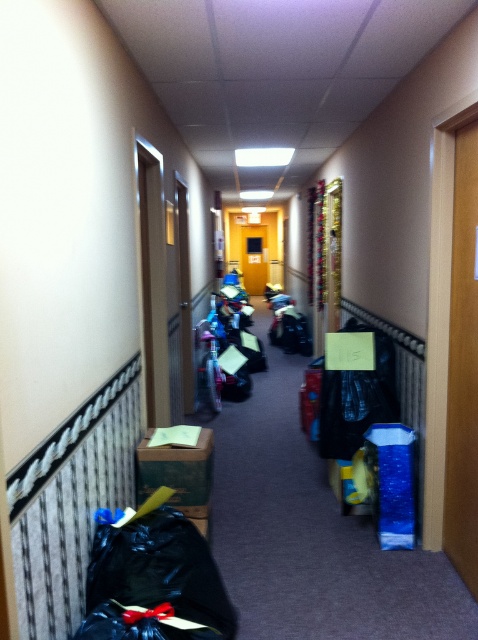
Is black plastic bag at lower left below green cardboard box at lower center?

Yes.

Is point (161, 586) positioned after point (141, 468)?

No, (161, 586) is closer to viewer.

Which is in front, point (98, 605) or point (203, 483)?

Point (98, 605) is in front.

This screenshot has height=640, width=478. I want to click on black plastic bag at lower left, so click(153, 580).